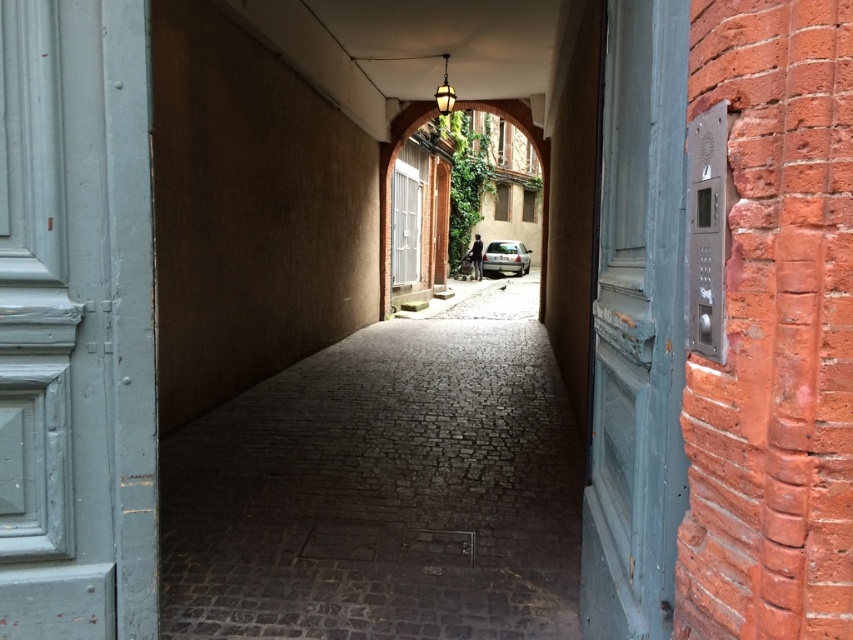
You are a delivery robot with a height of 1.5 meters. You need to navigate through the gray cobblestone path at center to reach the delivery point. However, there is a silver metallic car at center blocking your path. Based on the scene description, will the robot be able to pass under the silver metallic car without hitting its top part?

The gray cobblestone path at center is not as tall as the silver metallic car at center, which means the car is taller than the path. Since the robot is 1.5 meters tall and the car is taller than the path, the robot should be able to pass under the car without hitting its top part as long as there is enough vertical clearance. However, the exact height of the car isn not specified, so this depends on the actual clearance available.

You are standing at the entrance of the alley and want to walk to the parked car at the end. Which direction should you follow the gray cobblestone path at center to reach the parked car?

You should follow the gray cobblestone path at center towards the direction it leads, which is towards the open end of the alley where the parked car is located.

Based on the photo, you are standing at the entrance of the alleyway and want to walk towards the person standing near the parked car. Which point, point (509, 100) or point (518, 243), is closer to you as you start walking?

Point (509, 100) is closer to the camera than point (518, 243), so it is closer to you as you start walking from the entrance.